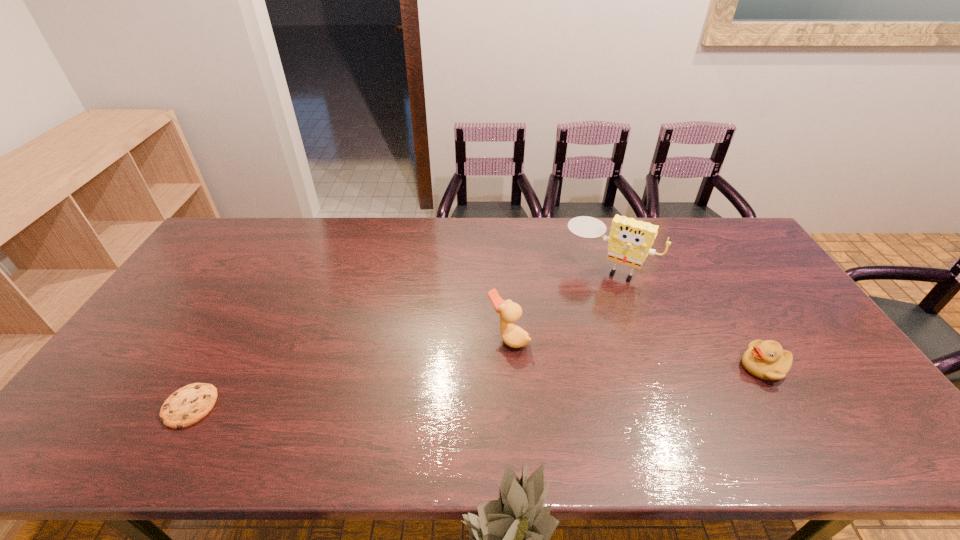
Locate an element on the screen. The height and width of the screenshot is (540, 960). duckling at the near edge is located at coordinates (767, 360).

Locate an element on the screen. This screenshot has width=960, height=540. object situated at the right edge is located at coordinates (767, 360).

This screenshot has height=540, width=960. In order to click on object situated at the near right corner in this screenshot , I will do `click(767, 360)`.

The height and width of the screenshot is (540, 960). Identify the location of vacant space at the far edge of the desktop. (518, 224).

Image resolution: width=960 pixels, height=540 pixels. I want to click on vacant area at the near edge, so click(x=739, y=413).

I want to click on vacant space at the left edge of the desktop, so click(x=223, y=280).

Where is `free space at the near left corner`? This screenshot has height=540, width=960. free space at the near left corner is located at coordinates (123, 409).

Locate an element on the screen. The width and height of the screenshot is (960, 540). free space at the far right corner of the desktop is located at coordinates (720, 232).

Identify the location of blank region between the duck and the leftmost object. (348, 372).

Locate an element on the screen. Image resolution: width=960 pixels, height=540 pixels. vacant area that lies between the second tallest object and the third tallest object is located at coordinates (636, 352).